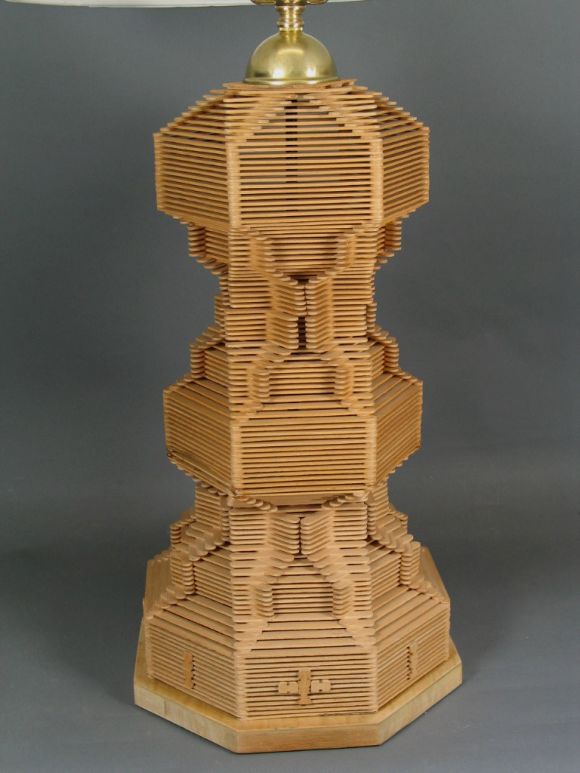
The height and width of the screenshot is (773, 580). I want to click on lamp shade, so click(150, 2).